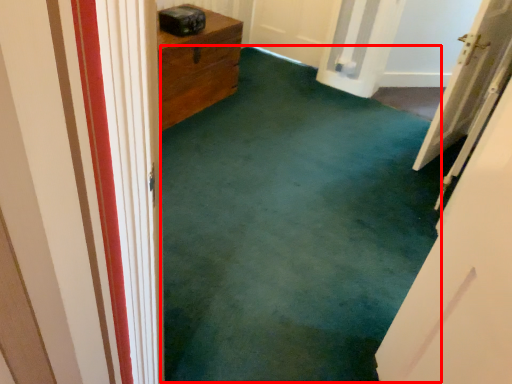
Question: From the image's perspective, what is the correct spatial positioning of corridor (annotated by the red box) in reference to door?

Choices:
 (A) above
 (B) below

Answer: (B)